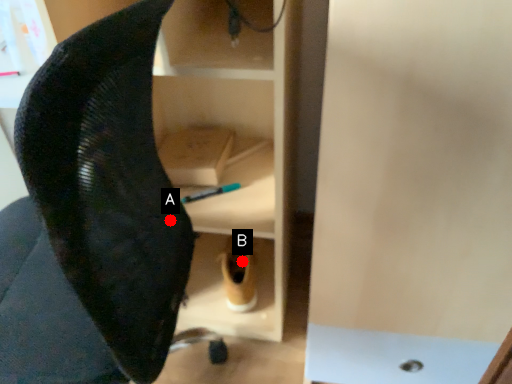
Question: Two points are circled on the image, labeled by A and B beside each circle. Which point is closer to the camera?

Choices:
 (A) A is closer
 (B) B is closer

Answer: (A)